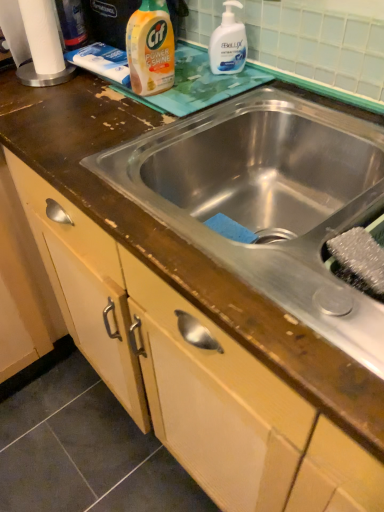
Question: Can you confirm if stainless steel sink at center is positioned to the right of yellow plastic bottle at upper center, the 2th cleaning product positioned from the right?

Choices:
 (A) no
 (B) yes

Answer: (B)

Question: Is stainless steel sink at center in contact with yellow plastic bottle at upper center, marked as the first cleaning product in a left-to-right arrangement?

Choices:
 (A) no
 (B) yes

Answer: (A)

Question: From a real-world perspective, is stainless steel sink at center positioned over yellow plastic bottle at upper center, marked as the first cleaning product in a left-to-right arrangement, based on gravity?

Choices:
 (A) no
 (B) yes

Answer: (A)

Question: Does stainless steel sink at center have a lesser width compared to yellow plastic bottle at upper center, the 2th cleaning product positioned from the right?

Choices:
 (A) no
 (B) yes

Answer: (A)

Question: Could you tell me if stainless steel sink at center is facing yellow plastic bottle at upper center, the 2th cleaning product positioned from the right?

Choices:
 (A) yes
 (B) no

Answer: (B)

Question: From a real-world perspective, is yellow plastic bottle at upper center, the 2th cleaning product positioned from the right, positioned above or below stainless steel sink at center?

Choices:
 (A) below
 (B) above

Answer: (B)

Question: Considering the positions of point (160, 61) and point (369, 322), is point (160, 61) closer or farther from the camera than point (369, 322)?

Choices:
 (A) farther
 (B) closer

Answer: (A)

Question: Considering the positions of yellow plastic bottle at upper center, marked as the first cleaning product in a left-to-right arrangement, and stainless steel sink at center in the image, is yellow plastic bottle at upper center, marked as the first cleaning product in a left-to-right arrangement, taller or shorter than stainless steel sink at center?

Choices:
 (A) tall
 (B) short

Answer: (A)

Question: In terms of size, does yellow plastic bottle at upper center, the 2th cleaning product positioned from the right, appear bigger or smaller than stainless steel sink at center?

Choices:
 (A) small
 (B) big

Answer: (A)

Question: Is white paper towel at upper left taller or shorter than yellow plastic bottle at upper center, marked as the first cleaning product in a left-to-right arrangement?

Choices:
 (A) tall
 (B) short

Answer: (B)

Question: Does point (36, 64) appear closer or farther from the camera than point (147, 5)?

Choices:
 (A) farther
 (B) closer

Answer: (A)

Question: From a real-world perspective, relative to yellow plastic bottle at upper center, the 2th cleaning product positioned from the right, is white paper towel at upper left vertically above or below?

Choices:
 (A) below
 (B) above

Answer: (A)

Question: Based on their positions, is white paper towel at upper left located to the left or right of yellow plastic bottle at upper center, marked as the first cleaning product in a left-to-right arrangement?

Choices:
 (A) left
 (B) right

Answer: (A)

Question: Is white glossy hand soap at upper right, the first cleaning product when ordered from right to left, situated inside yellow plastic bottle at upper center, the 2th cleaning product positioned from the right, or outside?

Choices:
 (A) outside
 (B) inside

Answer: (A)

Question: Would you say white glossy hand soap at upper right, which ranks as the second cleaning product in left-to-right order, is to the left or to the right of yellow plastic bottle at upper center, the 2th cleaning product positioned from the right, in the picture?

Choices:
 (A) left
 (B) right

Answer: (B)